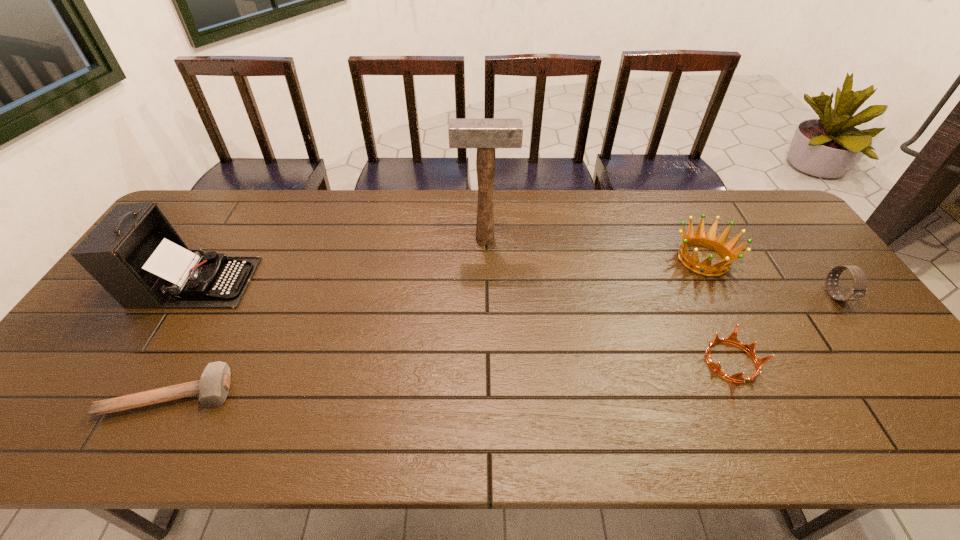
Identify the location of the right mallet. (484, 134).

The height and width of the screenshot is (540, 960). I want to click on the taller mallet, so click(484, 134).

This screenshot has height=540, width=960. In order to click on the second tallest object in this screenshot , I will do `click(134, 253)`.

Locate an element on the screen. the taller crown is located at coordinates (726, 250).

Identify the location of watch. Image resolution: width=960 pixels, height=540 pixels. (859, 289).

Identify the location of the shorter crown. (732, 339).

The width and height of the screenshot is (960, 540). What are the coordinates of `the nearer crown` in the screenshot? It's located at (732, 339).

What are the coordinates of `the left mallet` in the screenshot? It's located at pyautogui.click(x=213, y=387).

Locate an element on the screen. The width and height of the screenshot is (960, 540). the shorter mallet is located at coordinates (213, 387).

You are a GUI agent. You are given a task and a screenshot of the screen. Output one action in this format:
    pyautogui.click(x=<x>, y=<y>)
    Task: Click on the vacant space located 0.380m on the left of the taller mallet
    This screenshot has height=540, width=960.
    Given the screenshot: What is the action you would take?
    pyautogui.click(x=336, y=239)